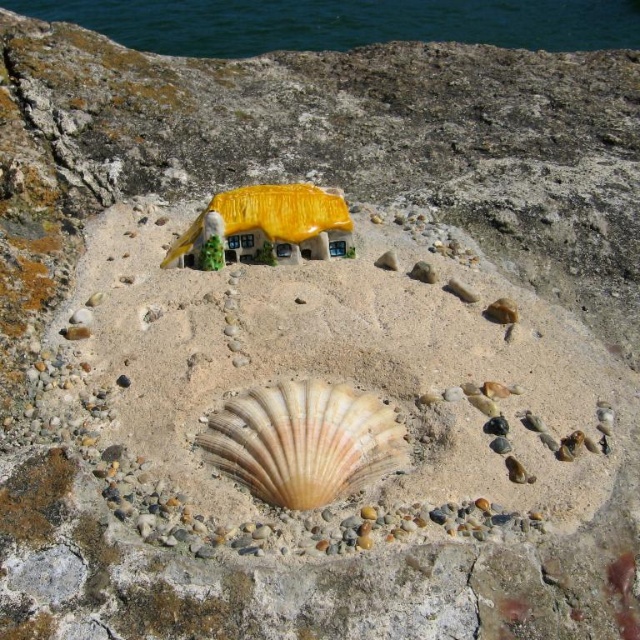
Question: Which point is closer to the camera?

Choices:
 (A) (26, 6)
 (B) (376, 470)

Answer: (B)

Question: Can you confirm if blue water at upper center is wider than beige scallop shell at center?

Choices:
 (A) no
 (B) yes

Answer: (B)

Question: Is blue water at upper center in front of beige scallop shell at center?

Choices:
 (A) yes
 (B) no

Answer: (B)

Question: Is blue water at upper center closer to camera compared to beige scallop shell at center?

Choices:
 (A) no
 (B) yes

Answer: (A)